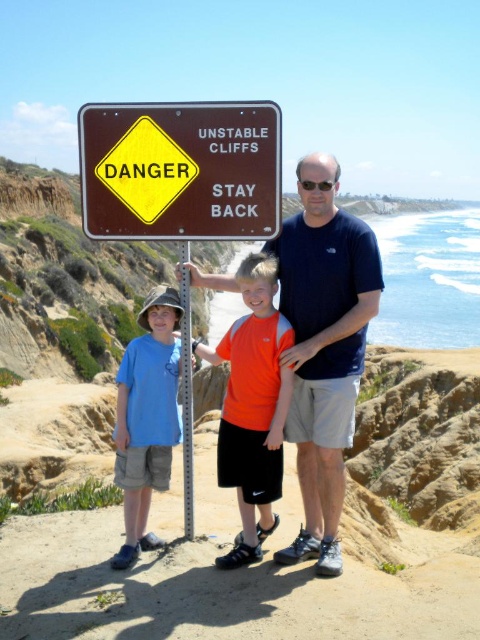
Question: Which is farther from the brown wooden sign at upper center?

Choices:
 (A) orange matte shirt at center
 (B) dark blue t-shirt at center
 (C) blue cotton shirt at center

Answer: (A)

Question: Does dark blue t-shirt at center have a lesser width compared to blue cotton shirt at center?

Choices:
 (A) no
 (B) yes

Answer: (B)

Question: Which point appears closest to the camera in this image?

Choices:
 (A) (120, 364)
 (B) (227, 435)

Answer: (B)

Question: Is brown wooden sign at upper center to the left of blue cotton shirt at center from the viewer's perspective?

Choices:
 (A) no
 (B) yes

Answer: (B)

Question: Which object is farther from the camera taking this photo?

Choices:
 (A) dark blue t-shirt at center
 (B) blue cotton shirt at center
 (C) brown wooden sign at upper center
 (D) orange matte shirt at center

Answer: (B)

Question: Is brown wooden sign at upper center to the right of orange matte shirt at center from the viewer's perspective?

Choices:
 (A) yes
 (B) no

Answer: (B)